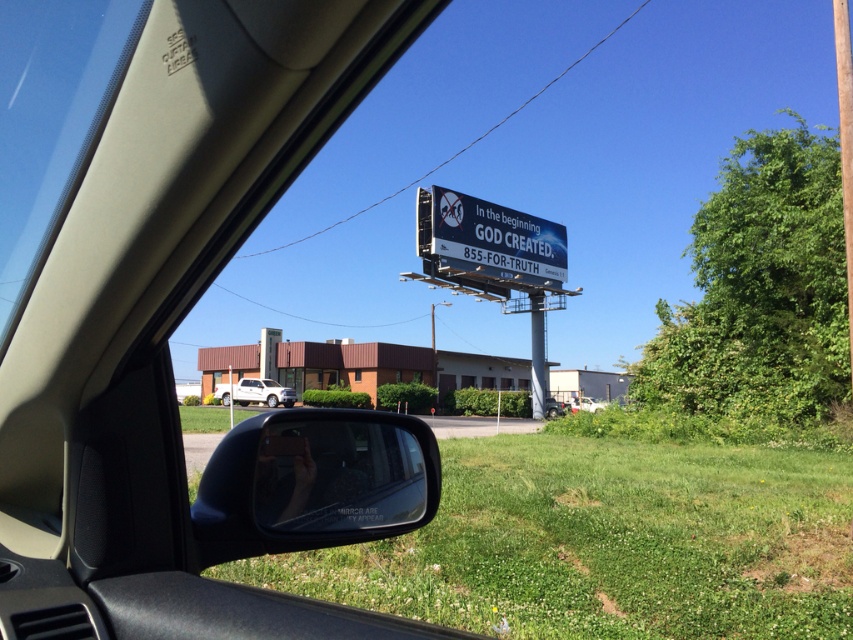
You are a driver checking your car mirrors. You notice the black glossy view mirror at lower center and the white matte car at center. Which object is wider?

The black glossy view mirror at lower center is wider than the white matte car at center according to the description provided.

You are a passenger in a car and notice the black glossy view mirror at lower center and the white matte car at center. Which object appears taller from your perspective?

The black glossy view mirror at lower center appears much taller than the white matte car at center from your perspective.